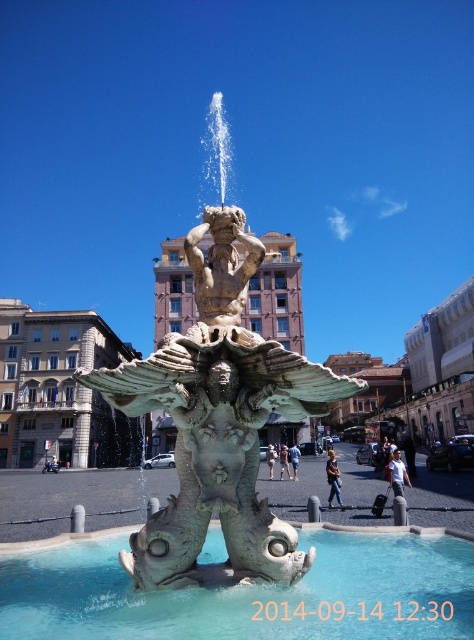
Who is higher up, bronze statue at center or clear glass water at center?

bronze statue at center is higher up.

Which is more to the left, bronze statue at center or clear glass water at center?

From the viewer's perspective, bronze statue at center appears more on the left side.

Between point (235, 305) and point (210, 540), which one is positioned in front?

Positioned in front is point (235, 305).

At what (x,y) coordinates should I click in order to perform the action: click on bronze statue at center. Please return your answer as a coordinate pair (x, y). This screenshot has height=640, width=474. Looking at the image, I should click on (218, 419).

Who is shorter, bronze statue at center or white marble statue at center?

white marble statue at center

Can you confirm if bronze statue at center is taller than white marble statue at center?

Indeed, bronze statue at center has a greater height compared to white marble statue at center.

Image resolution: width=474 pixels, height=640 pixels. Identify the location of bronze statue at center. (218, 419).

I want to click on bronze statue at center, so click(218, 419).

Does clear glass water at center appear on the left side of white marble statue at center?

Incorrect, clear glass water at center is not on the left side of white marble statue at center.

Between clear glass water at center and white marble statue at center, which one has less height?

Standing shorter between the two is clear glass water at center.

Between point (444, 634) and point (249, 244), which one is positioned in front?

Positioned in front is point (444, 634).

Where is `clear glass water at center`? The image size is (474, 640). clear glass water at center is located at coordinates (249, 595).